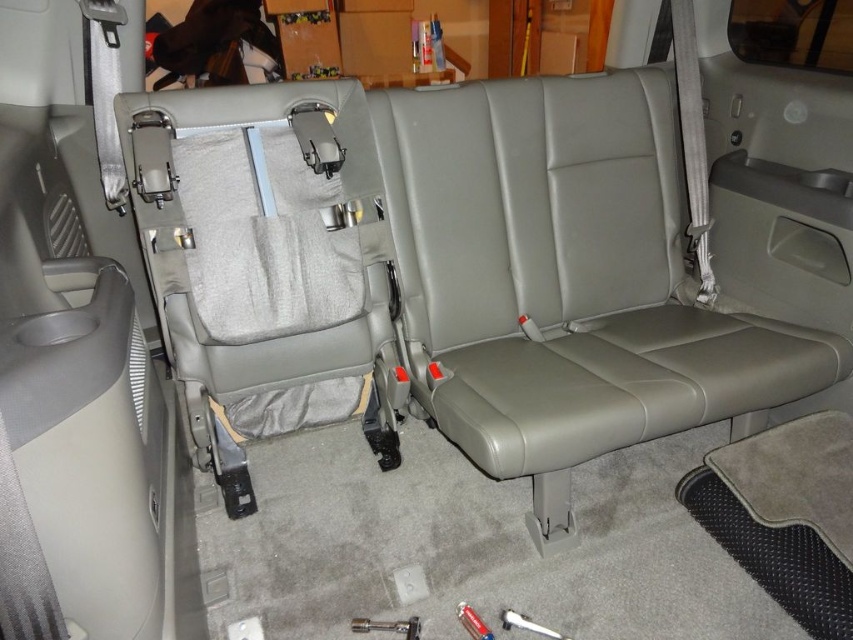
You are a mechanic trying to reach the tools in the vehicle. You see the metallic silver wrench at center and the metallic silver screwdriver at center. Which tool is larger?

The metallic silver wrench at center is bigger than the metallic silver screwdriver at center.

You are a mechanic trying to locate a wrench in the vehicle. The metallic silver wrench at center is at point (387, 627). Where would you find it?

The metallic silver wrench at center is located at point (387, 627), which is the center of the vehicle.